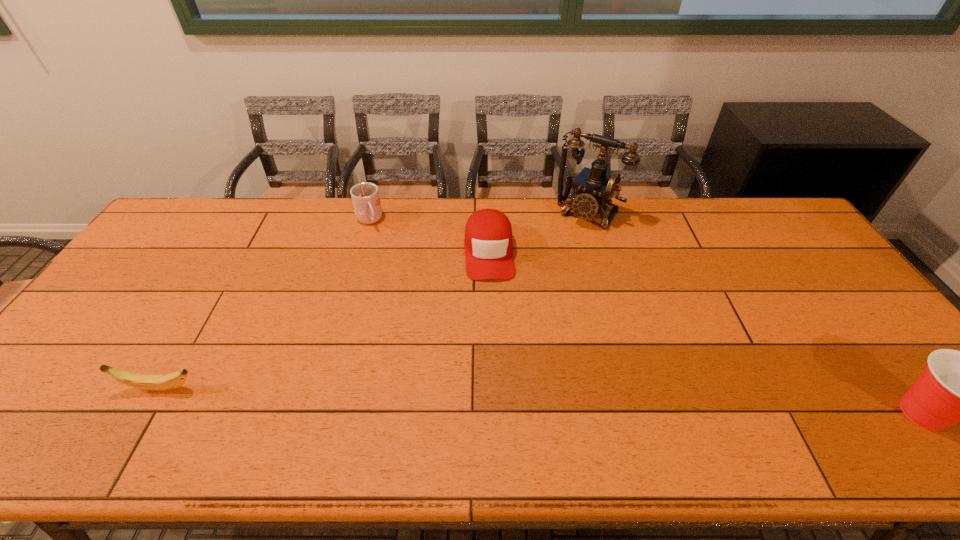
Where is `vacant position located at the stem of the shortest object`? This screenshot has height=540, width=960. vacant position located at the stem of the shortest object is located at coordinates (46, 388).

Where is `blank space located 0.320m on the front-facing side of the baseball cap`? The image size is (960, 540). blank space located 0.320m on the front-facing side of the baseball cap is located at coordinates (496, 376).

At what (x,y) coordinates should I click in order to perform the action: click on vacant position located on the front-facing side of the baseball cap. Please return your answer as a coordinate pair (x, y). This screenshot has height=540, width=960. Looking at the image, I should click on (498, 402).

This screenshot has height=540, width=960. Identify the location of vacant space located 0.360m on the front-facing side of the baseball cap. (497, 390).

The height and width of the screenshot is (540, 960). I want to click on free spot located 0.400m on the rotary dial of the tallest object, so click(x=519, y=306).

Identify the location of blank area located on the rotary dial of the tallest object. (534, 287).

This screenshot has height=540, width=960. I want to click on vacant space located on the rotary dial of the tallest object, so click(x=523, y=302).

The image size is (960, 540). I want to click on vacant position located on the side with the handle of the fourth object from right to left, so click(381, 247).

Locate an element on the screen. free space located on the side with the handle of the fourth object from right to left is located at coordinates (401, 285).

Identify the location of vacant space located on the side with the handle of the fourth object from right to left. (390, 262).